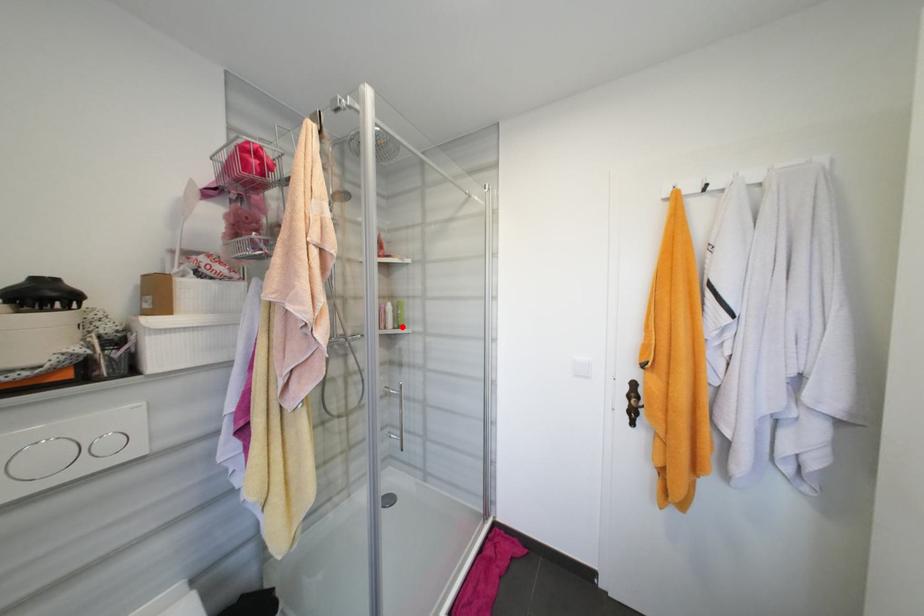
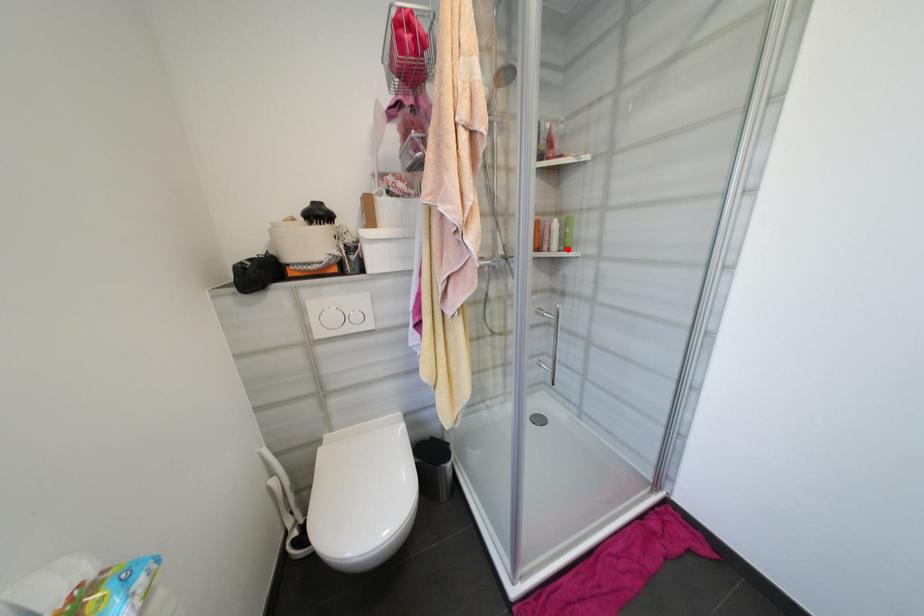
I am providing you with two images of the same scene from different viewpoints. A red point is marked on the first image and another point is marked on the second image. Does the point marked in image1 correspond to the same location as the one in image2?

Yes